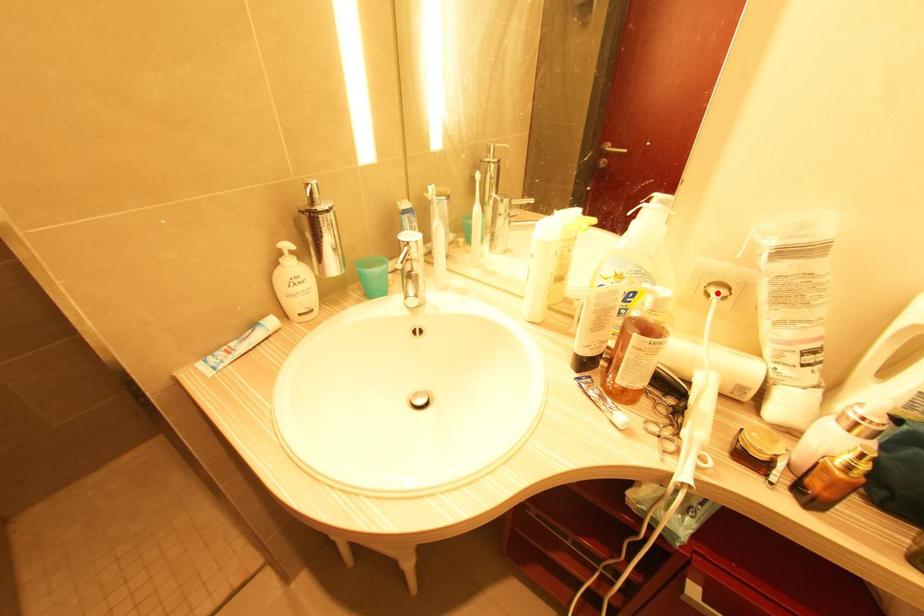
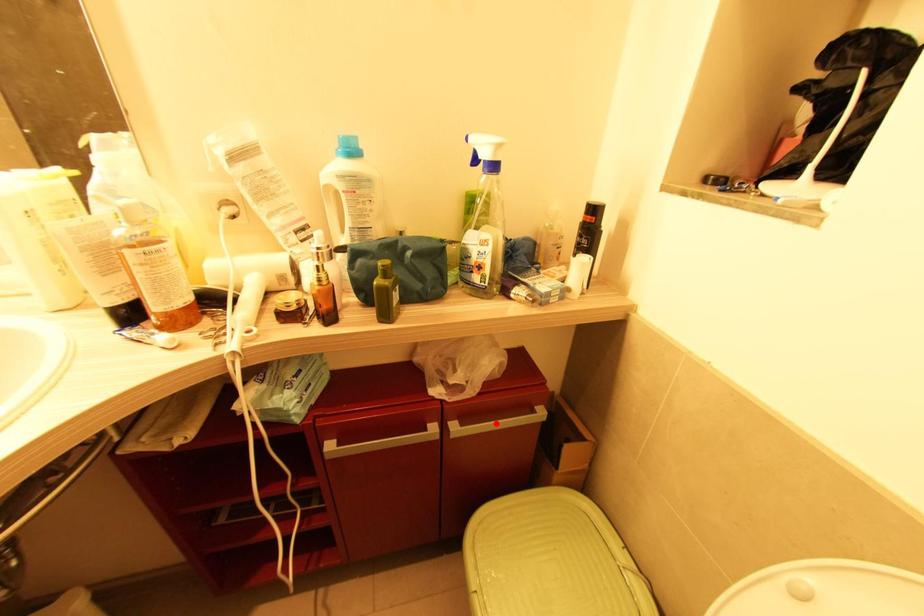
I am providing you with two images of the same scene from different viewpoints. A red point is marked on the first image and another point is marked on the second image. Are the points marked in image1 and image2 representing the same 3D position?

No